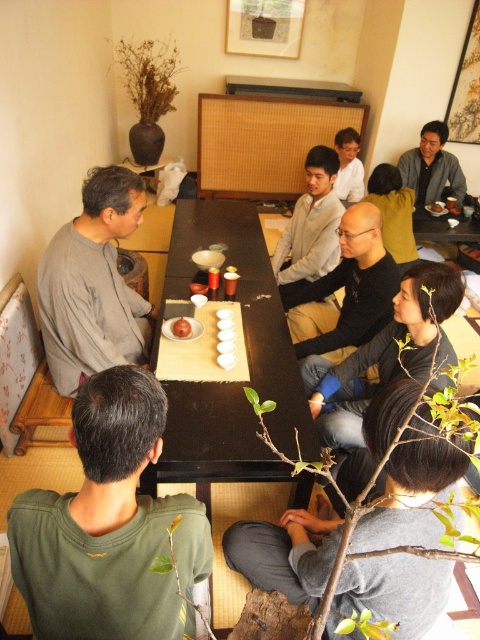
Is black matte shirt at center to the right of light gray sweater at center from the viewer's perspective?

Yes, black matte shirt at center is to the right of light gray sweater at center.

Can you confirm if black matte shirt at center is bigger than light gray sweater at center?

Incorrect, black matte shirt at center is not larger than light gray sweater at center.

In order to click on black matte shirt at center in this screenshot , I will do `click(347, 291)`.

Is point (38, 493) positioned in front of point (352, 340)?

That is True.

Between green cotton shirt at lower left and black matte shirt at center, which one appears on the right side from the viewer's perspective?

Positioned to the right is black matte shirt at center.

This screenshot has height=640, width=480. Find the location of `green cotton shirt at lower left`. green cotton shirt at lower left is located at coordinates tap(108, 525).

Can you confirm if green cotton shirt at lower left is thinner than light gray sweater at center?

No, green cotton shirt at lower left is not thinner than light gray sweater at center.

Between green cotton shirt at lower left and light gray sweater at center, which one appears on the left side from the viewer's perspective?

green cotton shirt at lower left

The width and height of the screenshot is (480, 640). In order to click on green cotton shirt at lower left in this screenshot , I will do `click(108, 525)`.